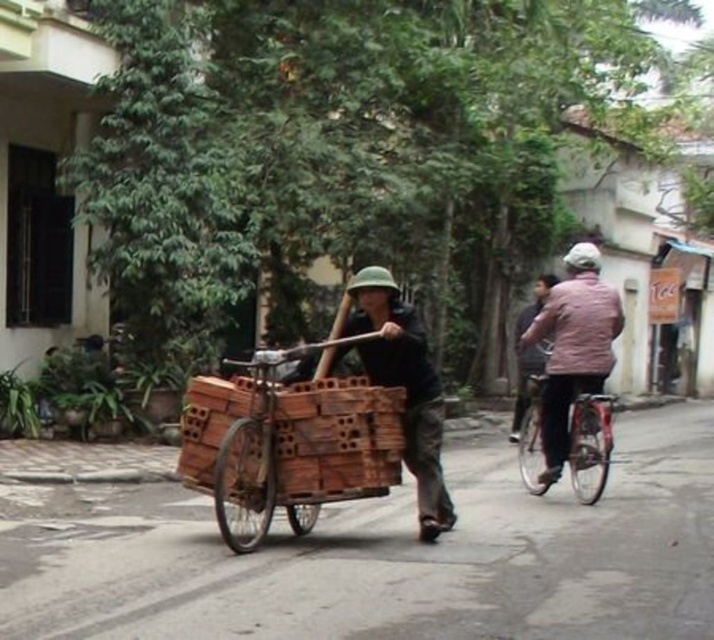
You are a pedestrian standing on the street and see the wooden cart at center and the pink fabric shirt at right. Which object takes up more space in the image?

The wooden cart at center is larger in size than the pink fabric shirt at right, so it takes up more space in the image.

You are a pedestrian trying to cross the street where the wooden helmet at center and the pink fabric shirt at right are visible. Which object is bigger in size?

The wooden helmet at center is larger in size than the pink fabric shirt at right.